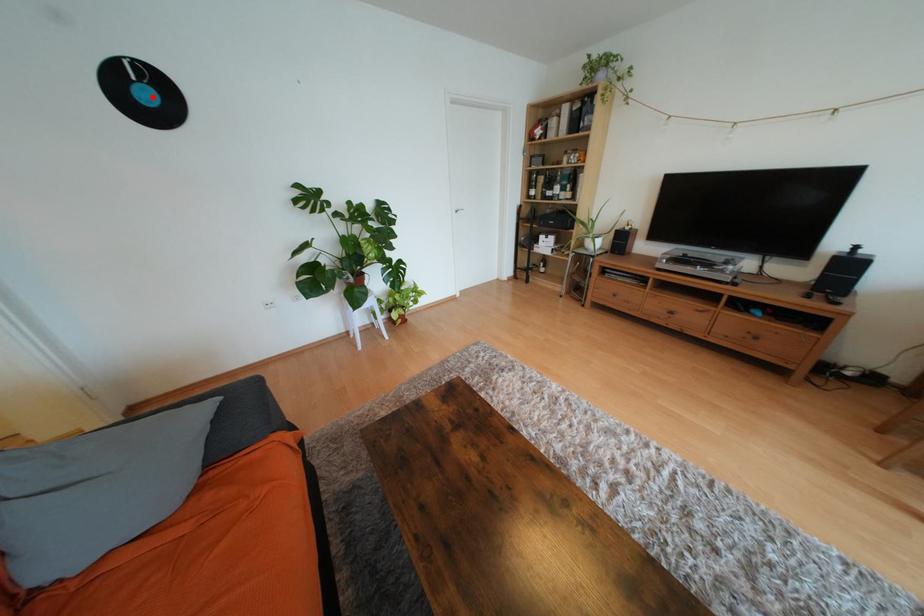
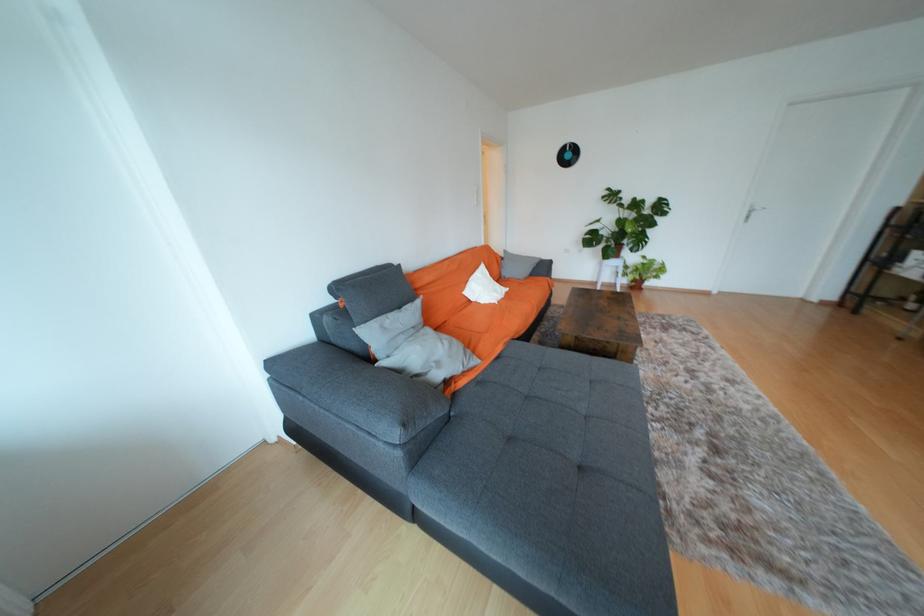
In the second image, find the point that corresponds to the highlighted location in the first image.

(574, 156)